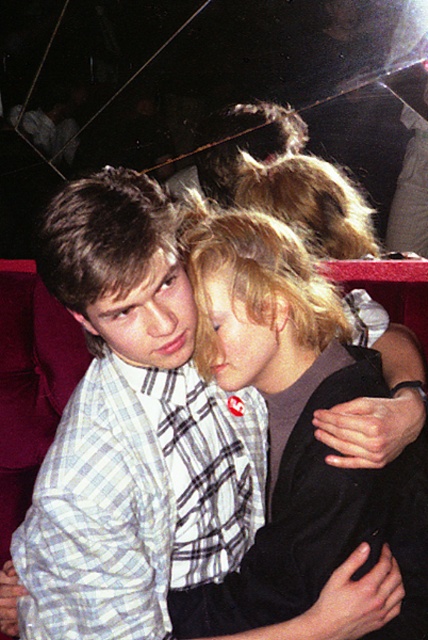
In the scene shown: Does white checkered shirt at center have a larger size compared to blonde hair at center?

Actually, white checkered shirt at center might be smaller than blonde hair at center.

Who is more forward, (x=65, y=461) or (x=284, y=612)?

Point (x=65, y=461)

Locate an element on the screen. white checkered shirt at center is located at coordinates (137, 500).